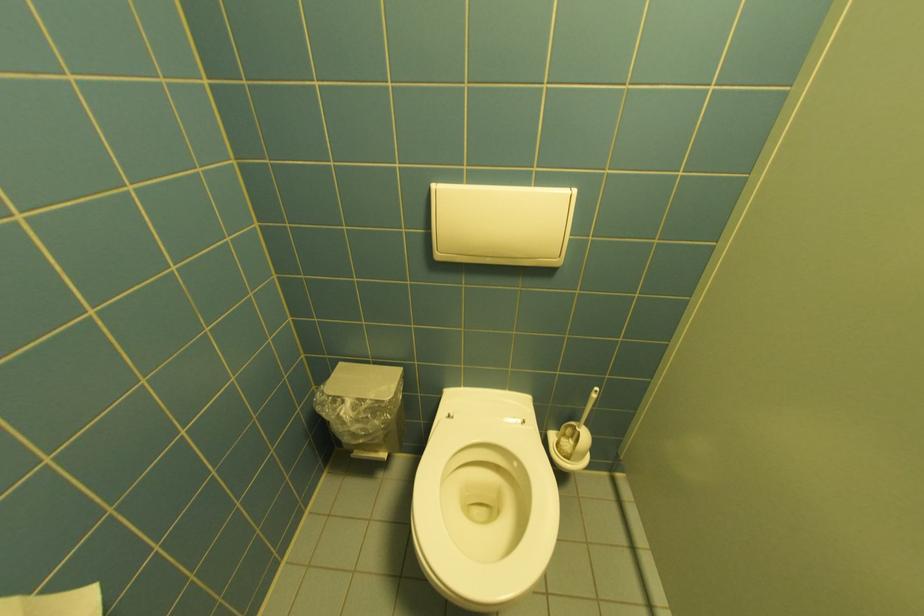
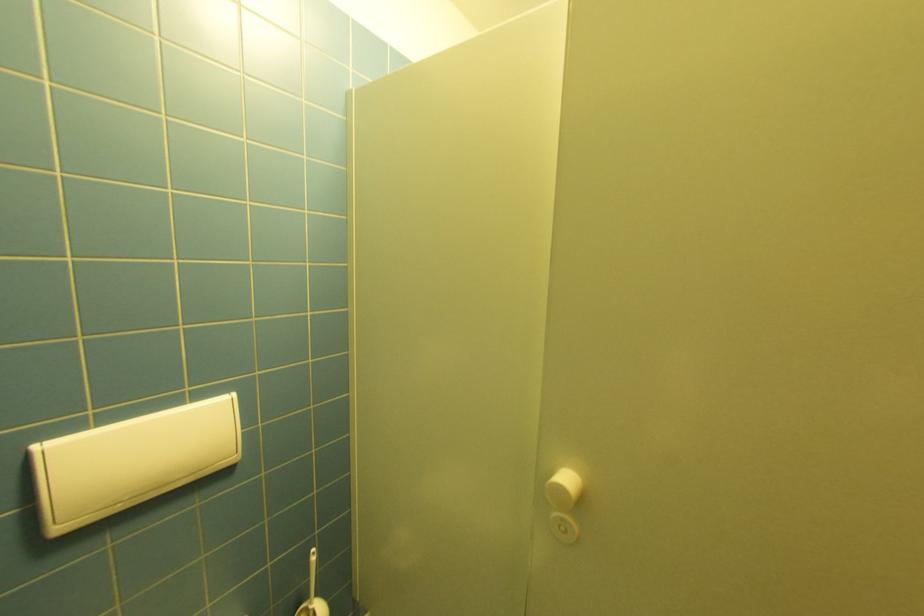
The point at [444,256] is marked in the first image. Where is the corresponding point in the second image?

(66, 530)